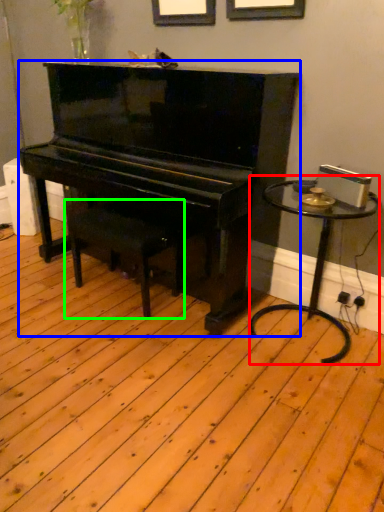
Question: Which object is the farthest from table (highlighted by a red box)? Choose among these: piano (highlighted by a blue box) or music stool (highlighted by a green box).

Choices:
 (A) piano
 (B) music stool

Answer: (B)